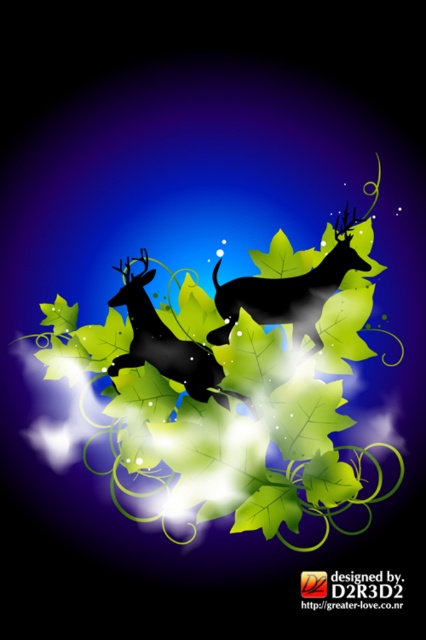
Between black matte deer at center and black matte/deeply textured deer at center, which one is positioned higher?

Positioned higher is black matte deer at center.

Is black matte deer at center positioned behind black matte/deeply textured deer at center?

That is False.

What do you see at coordinates (230, 413) in the screenshot? I see `black matte deer at center` at bounding box center [230, 413].

This screenshot has width=426, height=640. What are the coordinates of `black matte deer at center` in the screenshot? It's located at (230, 413).

Is point (371, 353) more distant than point (288, 285)?

Yes, it is.

Is black matte deer at center closer to the viewer compared to black matte/deer at center?

Yes.

This screenshot has width=426, height=640. Find the location of `black matte deer at center`. black matte deer at center is located at coordinates (230, 413).

This screenshot has width=426, height=640. What do you see at coordinates (287, 294) in the screenshot?
I see `black matte/deer at center` at bounding box center [287, 294].

Find the location of `black matte/deer at center`. black matte/deer at center is located at coordinates (287, 294).